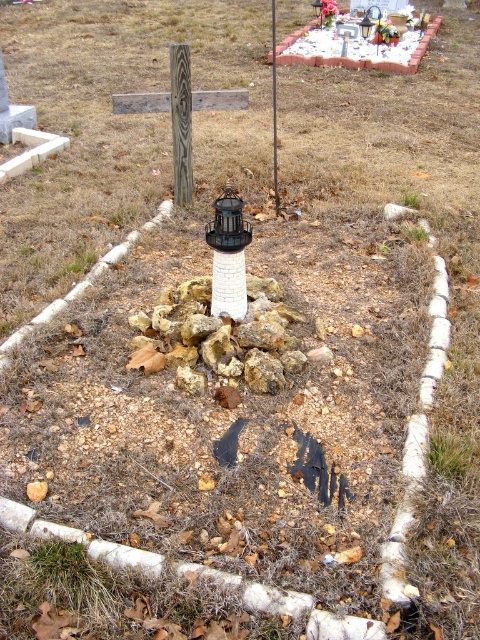
Question: Which point is closer to the camera?

Choices:
 (A) weathered wood post at center
 (B) green grass at center
 (C) black matte lamp post at center

Answer: (B)

Question: Is green grass at center closer to the viewer compared to brushed wood post at center?

Choices:
 (A) no
 (B) yes

Answer: (B)

Question: Estimate the real-world distances between objects in this image. Which object is closer to the weathered wood post at center?

Choices:
 (A) brushed wood post at center
 (B) black matte lamp post at center

Answer: (B)

Question: Which point is closer to the camera?

Choices:
 (A) (105, 612)
 (B) (273, 93)
 (C) (437, 472)
 (D) (236, 253)

Answer: (A)

Question: Considering the relative positions of green grass at lower left and black matte lamp post at center in the image provided, where is green grass at lower left located with respect to black matte lamp post at center?

Choices:
 (A) left
 (B) right

Answer: (A)

Question: Is weathered wood post at center above green grass at center?

Choices:
 (A) yes
 (B) no

Answer: (A)